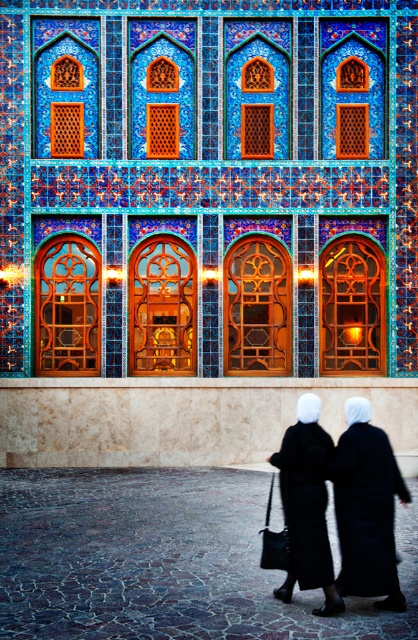
Question: Observing the image, what is the correct spatial positioning of black matte robe at lower center in reference to black matte robe at center?

Choices:
 (A) below
 (B) above

Answer: (A)

Question: Which of the following is the farthest from the observer?

Choices:
 (A) (33, 172)
 (B) (341, 520)

Answer: (A)

Question: In this image, where is blue mosaic tiles at center located relative to black matte robe at center?

Choices:
 (A) above
 (B) below

Answer: (A)

Question: Is blue mosaic tiles at center below black matte robe at center?

Choices:
 (A) no
 (B) yes

Answer: (A)

Question: Which object is positioned farthest from the black matte robe at lower center?

Choices:
 (A) black matte hijab at center
 (B) blue mosaic tiles at center
 (C) black matte robe at center

Answer: (B)

Question: Considering the real-world distances, which object is closest to the black matte hijab at center?

Choices:
 (A) black matte robe at center
 (B) black matte robe at lower center
 (C) blue mosaic tiles at center

Answer: (B)